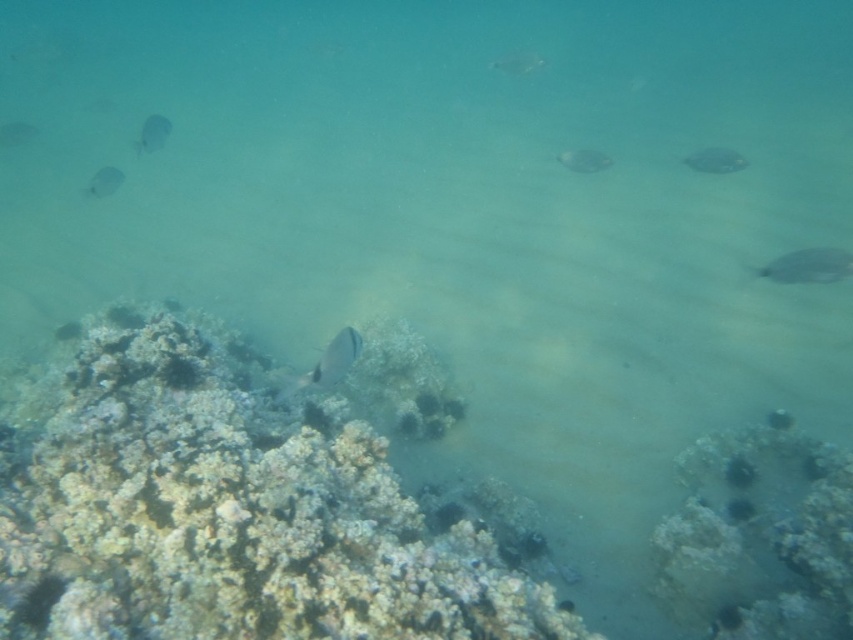
Question: Which object appears farthest from the camera in this image?

Choices:
 (A) smooth gray fish at center
 (B) translucent glass at upper center
 (C) shiny silver fish at right
 (D) white coral reef at center

Answer: (B)

Question: Based on their relative distances, which object is nearer to the translucent gray fish at upper left?

Choices:
 (A) white coral reef at center
 (B) silvery metallic fish at center

Answer: (B)

Question: Does white coral reef at center lie in front of translucent white fish at upper left?

Choices:
 (A) yes
 (B) no

Answer: (A)

Question: Does smooth silver fish at right appear over translucent glass at upper center?

Choices:
 (A) no
 (B) yes

Answer: (A)

Question: Which of the following is the closest to the observer?

Choices:
 (A) (848, 256)
 (B) (16, 122)
 (C) (236, 355)
 (D) (531, 60)

Answer: (A)

Question: Is white coral reef at center behind smooth silver fish at right?

Choices:
 (A) no
 (B) yes

Answer: (A)